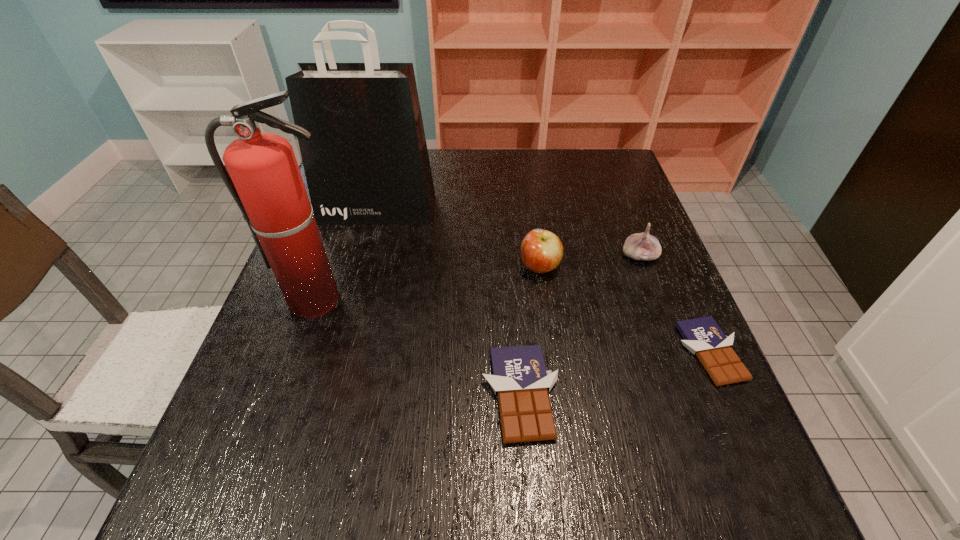
The image size is (960, 540). Find the location of `free space that satisfies the following two spatial constraints: 1. on the front with handles of the farthest object; 2. on the right side of the garlic`. free space that satisfies the following two spatial constraints: 1. on the front with handles of the farthest object; 2. on the right side of the garlic is located at coordinates (365, 256).

Image resolution: width=960 pixels, height=540 pixels. Identify the location of vacant space that satisfies the following two spatial constraints: 1. on the front with handles of the apple; 2. on the left side of the farthest object. (362, 267).

Where is `free space that satisfies the following two spatial constraints: 1. on the front with handles of the second shortest object; 2. on the left side of the shopping bag`? free space that satisfies the following two spatial constraints: 1. on the front with handles of the second shortest object; 2. on the left side of the shopping bag is located at coordinates (327, 395).

Locate an element on the screen. The height and width of the screenshot is (540, 960). vacant space that satisfies the following two spatial constraints: 1. on the front with handles of the shopping bag; 2. on the right side of the right chocolate bar is located at coordinates (339, 353).

Image resolution: width=960 pixels, height=540 pixels. Find the location of `vacant region that satisfies the following two spatial constraints: 1. on the front with handles of the farthest object; 2. on the left side of the apple`. vacant region that satisfies the following two spatial constraints: 1. on the front with handles of the farthest object; 2. on the left side of the apple is located at coordinates (362, 267).